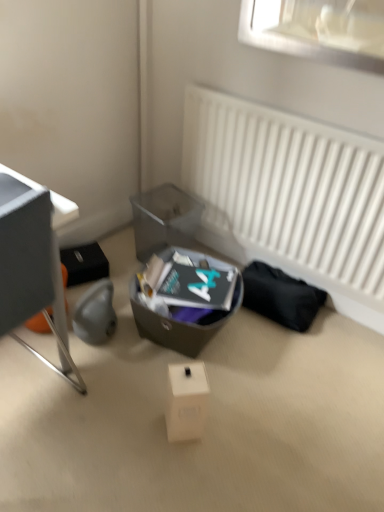
Locate an element on the screen. The image size is (384, 512). matte gray box at center is located at coordinates (178, 324).

Identify the location of white matte cardboard box at center. (186, 401).

The height and width of the screenshot is (512, 384). What do you see at coordinates (186, 401) in the screenshot?
I see `white matte cardboard box at center` at bounding box center [186, 401].

Describe the element at coordinates (289, 196) in the screenshot. I see `white matte radiator at upper right` at that location.

Describe the element at coordinates (30, 263) in the screenshot. The height and width of the screenshot is (512, 384). I see `metallic gray desk at left` at that location.

What are the coordinates of `matte gray box at center` in the screenshot? It's located at (178, 324).

This screenshot has width=384, height=512. I want to click on radiator that appears on the right of matte gray box at center, so click(x=289, y=196).

Looking at this image, is white matte radiator at upper right far away from matte gray box at center?

No, white matte radiator at upper right is not far from matte gray box at center.

Between white matte radiator at upper right and matte gray box at center, which one appears on the left side from the viewer's perspective?

matte gray box at center.

From the image's perspective, between matte gray box at center and translucent plastic shoe box at center, which one is located above?

From the image's view, translucent plastic shoe box at center is above.

How much distance is there between matte gray box at center and translucent plastic shoe box at center?

matte gray box at center is 32.46 centimeters away from translucent plastic shoe box at center.

Is matte gray box at center inside or outside of translucent plastic shoe box at center?

matte gray box at center is located beyond the bounds of translucent plastic shoe box at center.

Which object is thinner, matte gray box at center or translucent plastic shoe box at center?

Thinner between the two is translucent plastic shoe box at center.

Considering the sizes of objects metallic gray desk at left and white matte cardboard box at center in the image provided, who is thinner, metallic gray desk at left or white matte cardboard box at center?

white matte cardboard box at center.

Who is more distant, metallic gray desk at left or white matte cardboard box at center?

white matte cardboard box at center is further away from the camera.

How different are the orientations of metallic gray desk at left and white matte cardboard box at center in degrees?

The angular difference between metallic gray desk at left and white matte cardboard box at center is 135 degrees.

Considering the relative positions of metallic gray desk at left and white matte cardboard box at center in the image provided, is metallic gray desk at left to the right of white matte cardboard box at center from the viewer's perspective?

Incorrect, metallic gray desk at left is not on the right side of white matte cardboard box at center.

Based on the photo, how many degrees apart are the facing directions of white matte cardboard box at center and matte gray box at center?

There is a 51.7-degree angle between the facing directions of white matte cardboard box at center and matte gray box at center.

Considering the points (195, 414) and (238, 277), which point is in front, point (195, 414) or point (238, 277)?

Point (195, 414)

Is there a large distance between white matte cardboard box at center and matte gray box at center?

Actually, white matte cardboard box at center and matte gray box at center are a little close together.

Considering the relative sizes of white matte cardboard box at center and matte gray box at center in the image provided, is white matte cardboard box at center shorter than matte gray box at center?

Yes.

Is translucent plastic shoe box at center taller or shorter than white matte cardboard box at center?

Considering their sizes, translucent plastic shoe box at center has more height than white matte cardboard box at center.

Is translucent plastic shoe box at center facing away from white matte cardboard box at center?

translucent plastic shoe box at center is not turned away from white matte cardboard box at center.

Between translucent plastic shoe box at center and white matte cardboard box at center, which one has larger width?

translucent plastic shoe box at center is wider.

From the image's perspective, which object appears higher, translucent plastic shoe box at center or white matte cardboard box at center?

translucent plastic shoe box at center appears higher in the image.

From a real-world perspective, which object stands above the other?

metallic gray desk at left is physically above.

Between white matte radiator at upper right and metallic gray desk at left, which one has less height?

Standing shorter between the two is white matte radiator at upper right.

Is white matte radiator at upper right with metallic gray desk at left?

white matte radiator at upper right and metallic gray desk at left are not in contact.

Is metallic gray desk at left at the back of white matte radiator at upper right?

No, white matte radiator at upper right is not facing away from metallic gray desk at left.

Is white matte radiator at upper right at the back of translucent plastic shoe box at center?

No.

How different are the orientations of translucent plastic shoe box at center and white matte radiator at upper right in degrees?

They differ by 80.6 degrees in their facing directions.

Considering the relative sizes of translucent plastic shoe box at center and white matte radiator at upper right in the image provided, is translucent plastic shoe box at center smaller than white matte radiator at upper right?

Indeed, translucent plastic shoe box at center has a smaller size compared to white matte radiator at upper right.

Between point (174, 194) and point (296, 127), which one is positioned behind?

The point (174, 194) is more distant.

Identify the location of radiator on the right of the matte gray box at center. This screenshot has height=512, width=384. (289, 196).

Identify the location of box that appears below the translucent plastic shoe box at center (from the image's perspective). (178, 324).

Which object lies nearer to the anchor point translucent plastic shoe box at center, matte gray box at center or white matte cardboard box at center?

Among the two, matte gray box at center is located nearer to translucent plastic shoe box at center.

Which object lies nearer to the anchor point matte gray box at center, translucent plastic shoe box at center or metallic gray desk at left?

Among the two, translucent plastic shoe box at center is located nearer to matte gray box at center.

From the image, which object appears to be farther from white matte radiator at upper right, matte gray box at center or translucent plastic shoe box at center?

matte gray box at center is further to white matte radiator at upper right.

Based on their spatial positions, is white matte radiator at upper right or metallic gray desk at left closer to white matte cardboard box at center?

Based on the image, metallic gray desk at left appears to be nearer to white matte cardboard box at center.

Based on their spatial positions, is metallic gray desk at left or white matte cardboard box at center closer to white matte radiator at upper right?

The object closer to white matte radiator at upper right is white matte cardboard box at center.

Considering their positions, is white matte radiator at upper right positioned closer to translucent plastic shoe box at center than white matte cardboard box at center?

white matte radiator at upper right lies closer to translucent plastic shoe box at center than the other object.

Considering their positions, is white matte radiator at upper right positioned closer to matte gray box at center than white matte cardboard box at center?

Among the two, white matte cardboard box at center is located nearer to matte gray box at center.

Looking at the image, which one is located closer to white matte radiator at upper right, translucent plastic shoe box at center or white matte cardboard box at center?

The object closer to white matte radiator at upper right is translucent plastic shoe box at center.

Locate an element on the screen. box between metallic gray desk at left and translucent plastic shoe box at center along the z-axis is located at coordinates [x=178, y=324].

The width and height of the screenshot is (384, 512). What are the coordinates of `cardboard box between metallic gray desk at left and white matte radiator at upper right in the horizontal direction` in the screenshot? It's located at (186, 401).

In order to click on box situated between metallic gray desk at left and white matte radiator at upper right from left to right in this screenshot , I will do pos(178,324).

Image resolution: width=384 pixels, height=512 pixels. Identify the location of box between translucent plastic shoe box at center and white matte cardboard box at center in the up-down direction. (178, 324).